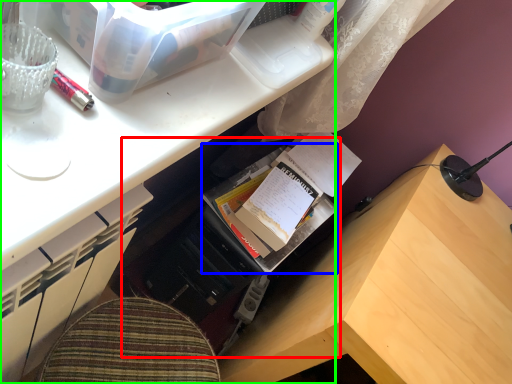
Question: Based on their relative distances, which object is nearer to bookshelf (highlighted by a red box)? Choose from book (highlighted by a blue box) and desk (highlighted by a green box).

Choices:
 (A) book
 (B) desk

Answer: (A)